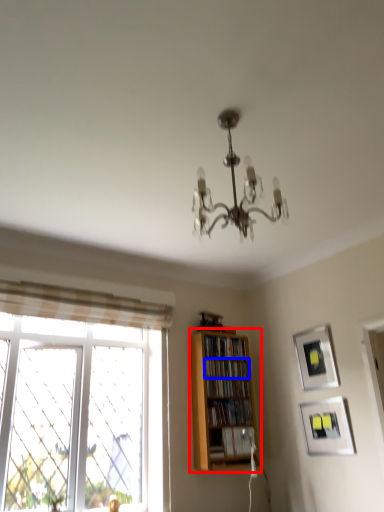
Question: Which object is further to the camera taking this photo, shelf (highlighted by a red box) or book (highlighted by a blue box)?

Choices:
 (A) shelf
 (B) book

Answer: (B)